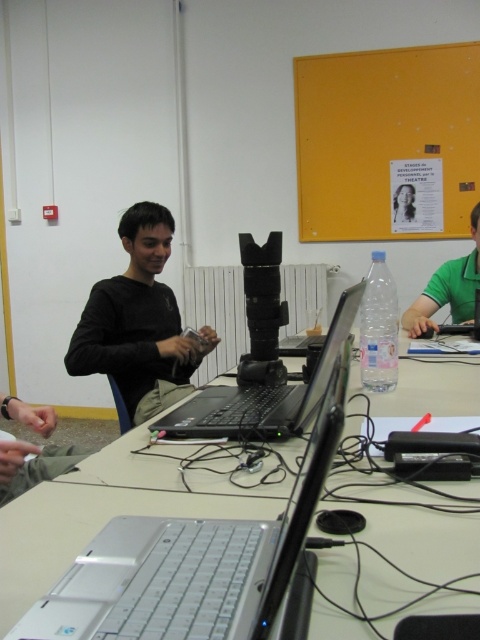
You are standing in the classroom and want to place a small object exactly at the point labeled as point (88, 548). Where should you place it?

You should place the small object on the white plastic table at center because the point (88, 548) is located there.

You are setting up a desk for a presentation and need to place both the matte black laptop at center and the black plastic laptop at center so that the taller one is closer to the audience. Which laptop should be placed closer to the audience?

The black plastic laptop at center should be placed closer to the audience because it has a greater height than the matte black laptop at center.